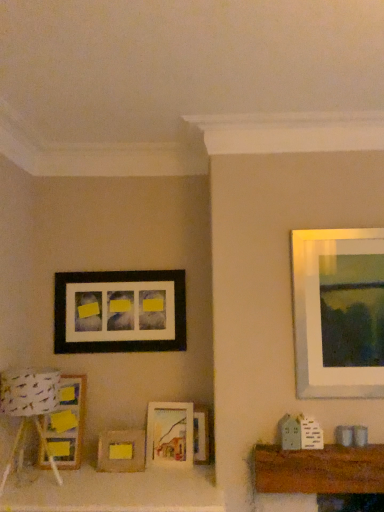
Question: Is white paper lampshade at lower left to the left or to the right of matte wooden picture frame at lower left, which ranks as the second picture frame in top-to-bottom order, in the image?

Choices:
 (A) left
 (B) right

Answer: (A)

Question: Choose the correct answer: Is white paper lampshade at lower left inside matte wooden picture frame at lower left, which ranks as the second picture frame in top-to-bottom order, or outside it?

Choices:
 (A) inside
 (B) outside

Answer: (B)

Question: Based on their relative distances, which object is farther from the matte wood picture frame at center, marked as the first picture frame in a bottom-to-top arrangement?

Choices:
 (A) white paper lampshade at lower left
 (B) matte black picture frame at upper left, the 1th picture frame in the top-to-bottom sequence
 (C) matte wooden picture frame at lower left, the 4th picture frame from the bottom
 (D) matte wooden picture frame at center, the third picture frame positioned from the bottom
 (E) wooden picture frame at center, which ranks as the fourth picture frame in top-to-bottom order

Answer: (B)

Question: Which object is the farthest from the matte black picture frame at upper left, placed as the 5th picture frame when sorted from bottom to top?

Choices:
 (A) white paper lampshade at lower left
 (B) matte wood picture frame at center, which is counted as the 5th picture frame, starting from the top
 (C) matte wooden picture frame at center, the third picture frame positioned from the bottom
 (D) matte wooden picture frame at lower left, the 4th picture frame from the bottom
 (E) wooden picture frame at center, which is the 2th picture frame from bottom to top

Answer: (E)